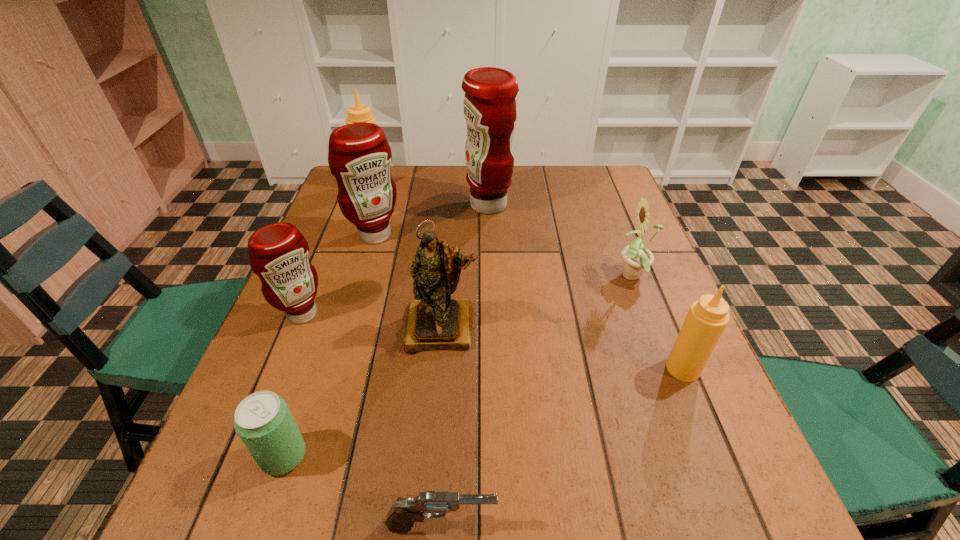
Identify which red condiment is the third closest to the soda. Please provide its 2D coordinates. Your answer should be formatted as a tuple, i.e. [(x, y)], where the tuple contains the x and y coordinates of a point satisfying the conditions above.

[(490, 111)]

Where is `vacant space that satisfies the following two spatial constraints: 1. on the front side of the third nearest object; 2. at the barrel of the pistol`? vacant space that satisfies the following two spatial constraints: 1. on the front side of the third nearest object; 2. at the barrel of the pistol is located at coordinates (748, 525).